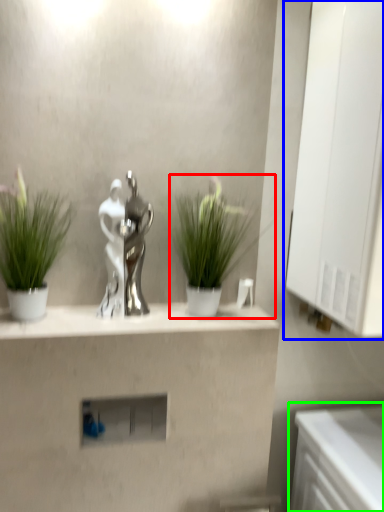
Question: Considering the real-world distances, which object is farthest from houseplant (highlighted by a red box)? medicine cabinet (highlighted by a blue box) or counter (highlighted by a green box)?

Choices:
 (A) medicine cabinet
 (B) counter

Answer: (B)